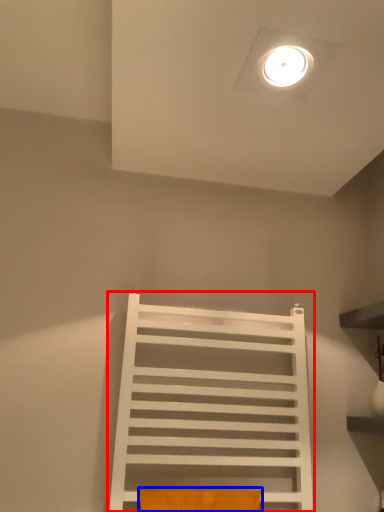
Question: Which point is further to the camera, furniture (highlighted by a red box) or pillow (highlighted by a blue box)?

Choices:
 (A) furniture
 (B) pillow

Answer: (A)